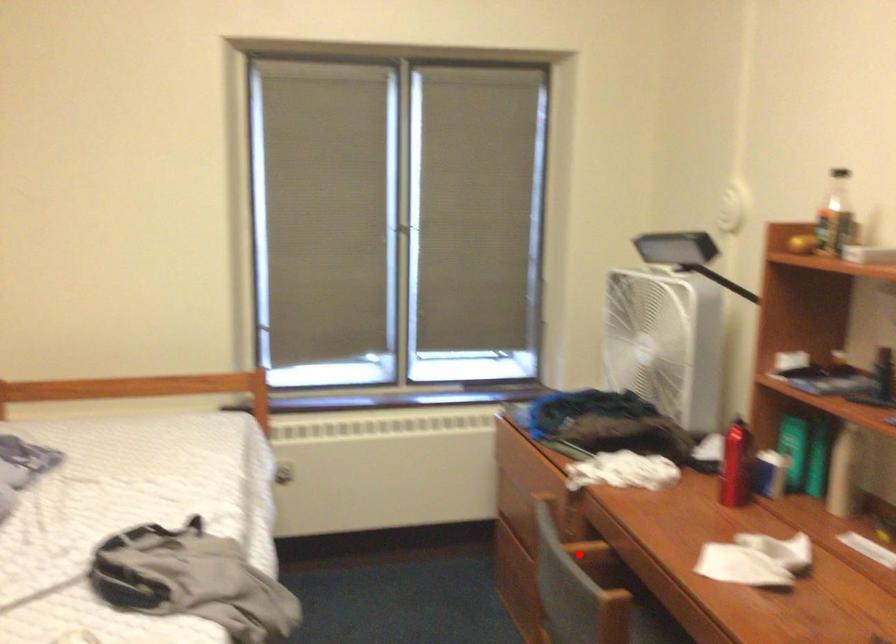
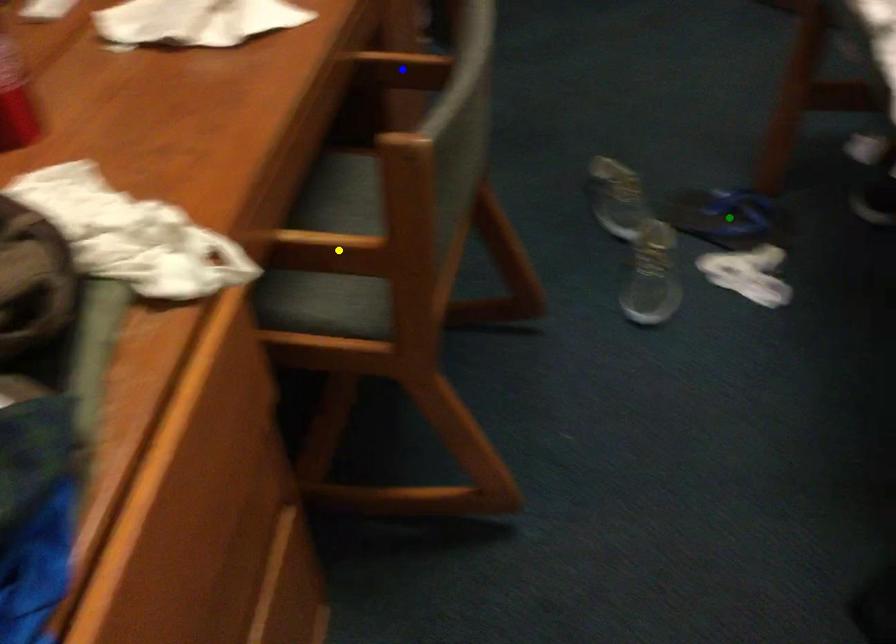
Question: I am providing you with two images of the same scene from different viewpoints. A red point is marked on the first image. You are given multiple points on the second image. Which point in image 2 is actually the same real-world point as the red point in image 1?

Choices:
 (A) green point
 (B) yellow point
 (C) blue point

Answer: (B)